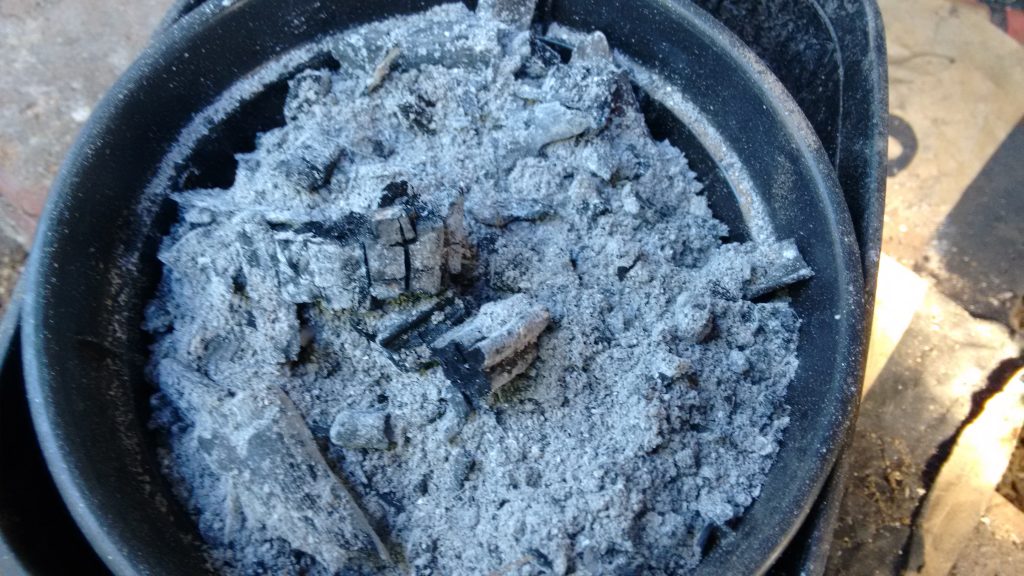
You are a GUI agent. You are given a task and a screenshot of the screen. Output one action in this format:
    pyautogui.click(x=<x>, y=<y>)
    Task: Click on the floor
    This screenshot has height=576, width=1024.
    Given the screenshot: What is the action you would take?
    pyautogui.click(x=111, y=16), pyautogui.click(x=28, y=50), pyautogui.click(x=28, y=106), pyautogui.click(x=22, y=223), pyautogui.click(x=81, y=81), pyautogui.click(x=923, y=33), pyautogui.click(x=953, y=72), pyautogui.click(x=942, y=162), pyautogui.click(x=871, y=245), pyautogui.click(x=918, y=228)